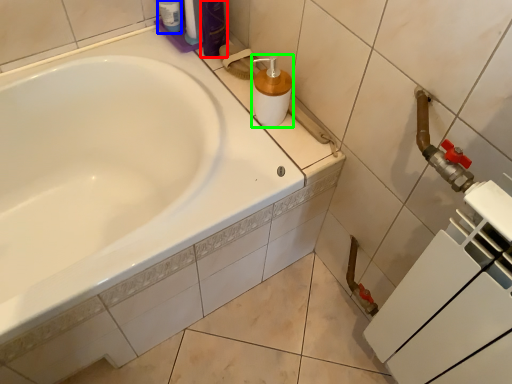
Question: Which is nearer to the toiletry (highlighted by a red box)? toiletry (highlighted by a blue box) or soap dispenser (highlighted by a green box).

Choices:
 (A) toiletry
 (B) soap dispenser

Answer: (A)